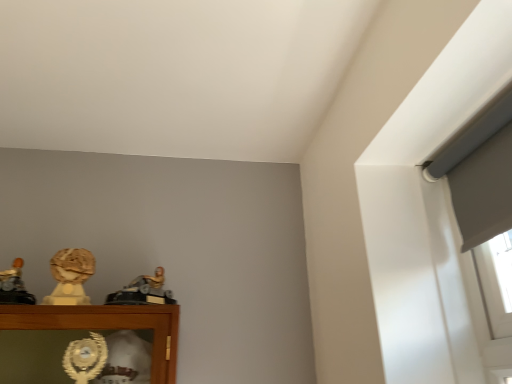
How much space does matte gold bust at left, which appears as the 2th character sculpture when viewed from the left, occupy vertically?

matte gold bust at left, which appears as the 2th character sculpture when viewed from the left, is 6.06 inches in height.

Describe the element at coordinates (14, 286) in the screenshot. This screenshot has height=384, width=512. I see `matte gold statue at left, the 1th character sculpture viewed from the left` at that location.

In order to click on gold metallic figure at center, arranged as the 3th character sculpture when viewed from the left in this screenshot , I will do `click(143, 291)`.

The width and height of the screenshot is (512, 384). I want to click on the 1st character sculpture behind when counting from the matte gold statue at left, the 1th character sculpture viewed from the left, so click(143, 291).

Which of these two, matte gold statue at left, the 1th character sculpture viewed from the left, or gold metallic figure at center, which appears as the first character sculpture when viewed from the right, stands taller?

matte gold statue at left, the 1th character sculpture viewed from the left, is taller.

Is point (12, 282) positioned behind point (136, 304)?

Yes, point (12, 282) is behind point (136, 304).

Is matte gold statue at left, the 3th character sculpture from the right, positioned beyond the bounds of gold metallic figure at center, which appears as the first character sculpture when viewed from the right?

Yes, matte gold statue at left, the 3th character sculpture from the right, is not within gold metallic figure at center, which appears as the first character sculpture when viewed from the right.

Considering the relative positions of gold metallic figure at center, arranged as the 3th character sculpture when viewed from the left, and matte gold bust at left, the second character sculpture positioned from the right, in the image provided, is gold metallic figure at center, arranged as the 3th character sculpture when viewed from the left, to the left of matte gold bust at left, the second character sculpture positioned from the right, from the viewer's perspective?

In fact, gold metallic figure at center, arranged as the 3th character sculpture when viewed from the left, is to the right of matte gold bust at left, the second character sculpture positioned from the right.

Does gold metallic figure at center, which appears as the first character sculpture when viewed from the right, have a greater height compared to matte gold bust at left, which appears as the 2th character sculpture when viewed from the left?

In fact, gold metallic figure at center, which appears as the first character sculpture when viewed from the right, may be shorter than matte gold bust at left, which appears as the 2th character sculpture when viewed from the left.

Consider the image. From a real-world perspective, between gold metallic figure at center, arranged as the 3th character sculpture when viewed from the left, and matte gold bust at left, the second character sculpture positioned from the right, who is vertically lower?

gold metallic figure at center, arranged as the 3th character sculpture when viewed from the left, from a real-world perspective.

Can you confirm if gold metallic figure at center, which appears as the first character sculpture when viewed from the right, is wider than matte gold bust at left, the second character sculpture positioned from the right?

Yes, gold metallic figure at center, which appears as the first character sculpture when viewed from the right, is wider than matte gold bust at left, the second character sculpture positioned from the right.

Considering their positions, is gold metallic figure at center, which appears as the first character sculpture when viewed from the right, located in front of or behind matte gold statue at left, the 3th character sculpture from the right?

gold metallic figure at center, which appears as the first character sculpture when viewed from the right, is behind matte gold statue at left, the 3th character sculpture from the right.

Which of these two, gold metallic figure at center, arranged as the 3th character sculpture when viewed from the left, or matte gold statue at left, the 3th character sculpture from the right, stands taller?

Standing taller between the two is matte gold statue at left, the 3th character sculpture from the right.

Is gold metallic figure at center, arranged as the 3th character sculpture when viewed from the left, far away from matte gold statue at left, the 3th character sculpture from the right?

They are positioned close to each other.

Are matte gold statue at left, the 3th character sculpture from the right, and matte gold bust at left, the second character sculpture positioned from the right, beside each other?

They are not placed beside each other.

In the image, is matte gold statue at left, the 1th character sculpture viewed from the left, positioned in front of or behind matte gold bust at left, which appears as the 2th character sculpture when viewed from the left?

matte gold statue at left, the 1th character sculpture viewed from the left, is positioned closer to the viewer than matte gold bust at left, which appears as the 2th character sculpture when viewed from the left.

From the picture: From the image's perspective, is matte gold statue at left, the 1th character sculpture viewed from the left, on top of matte gold bust at left, the second character sculpture positioned from the right?

No, from the image's perspective, matte gold statue at left, the 1th character sculpture viewed from the left, is not on top of matte gold bust at left, the second character sculpture positioned from the right.

Is matte gold bust at left, the second character sculpture positioned from the right, shorter than gold metallic figure at center, which appears as the first character sculpture when viewed from the right?

No, matte gold bust at left, the second character sculpture positioned from the right, is not shorter than gold metallic figure at center, which appears as the first character sculpture when viewed from the right.

Looking at this image, from the image's perspective, is matte gold bust at left, which appears as the 2th character sculpture when viewed from the left, beneath gold metallic figure at center, arranged as the 3th character sculpture when viewed from the left?

Actually, matte gold bust at left, which appears as the 2th character sculpture when viewed from the left, appears above gold metallic figure at center, arranged as the 3th character sculpture when viewed from the left, in the image.

Is matte gold bust at left, which appears as the 2th character sculpture when viewed from the left, outside of gold metallic figure at center, which appears as the first character sculpture when viewed from the right?

Yes, matte gold bust at left, which appears as the 2th character sculpture when viewed from the left, is located beyond the bounds of gold metallic figure at center, which appears as the first character sculpture when viewed from the right.

Considering the relative sizes of matte gold bust at left, the second character sculpture positioned from the right, and gold metallic figure at center, arranged as the 3th character sculpture when viewed from the left, in the image provided, is matte gold bust at left, the second character sculpture positioned from the right, bigger than gold metallic figure at center, arranged as the 3th character sculpture when viewed from the left,?

No.

In the scene shown: Is matte gold bust at left, which appears as the 2th character sculpture when viewed from the left, facing away from matte gold statue at left, the 3th character sculpture from the right?

matte gold bust at left, which appears as the 2th character sculpture when viewed from the left, does not have its back to matte gold statue at left, the 3th character sculpture from the right.

Is matte gold bust at left, which appears as the 2th character sculpture when viewed from the left, not near matte gold statue at left, the 3th character sculpture from the right?

No, matte gold bust at left, which appears as the 2th character sculpture when viewed from the left, is in close proximity to matte gold statue at left, the 3th character sculpture from the right.

Based on their sizes in the image, would you say matte gold bust at left, which appears as the 2th character sculpture when viewed from the left, is bigger or smaller than matte gold statue at left, the 3th character sculpture from the right?

matte gold bust at left, which appears as the 2th character sculpture when viewed from the left, is smaller than matte gold statue at left, the 3th character sculpture from the right.

Between matte gold bust at left, the second character sculpture positioned from the right, and matte gold statue at left, the 1th character sculpture viewed from the left, which one has larger width?

matte gold statue at left, the 1th character sculpture viewed from the left.

Image resolution: width=512 pixels, height=384 pixels. There is a gold metallic figure at center, which appears as the first character sculpture when viewed from the right. Find the location of `the 1st character sculpture above it (from the image's perspective)`. the 1st character sculpture above it (from the image's perspective) is located at coordinates (14, 286).

At what (x,y) coordinates should I click in order to perform the action: click on character sculpture above the gold metallic figure at center, arranged as the 3th character sculpture when viewed from the left (from a real-world perspective). Please return your answer as a coordinate pair (x, y). This screenshot has width=512, height=384. Looking at the image, I should click on (70, 276).

Looking at the image, which one is located further to matte gold bust at left, which appears as the 2th character sculpture when viewed from the left, matte gold statue at left, the 1th character sculpture viewed from the left, or gold metallic figure at center, arranged as the 3th character sculpture when viewed from the left?

Based on the image, matte gold statue at left, the 1th character sculpture viewed from the left, appears to be further to matte gold bust at left, which appears as the 2th character sculpture when viewed from the left.

When comparing their distances from gold metallic figure at center, which appears as the first character sculpture when viewed from the right, does matte gold statue at left, the 3th character sculpture from the right, or matte gold bust at left, the second character sculpture positioned from the right, seem further?

Based on the image, matte gold statue at left, the 3th character sculpture from the right, appears to be further to gold metallic figure at center, which appears as the first character sculpture when viewed from the right.

Looking at the image, which one is located closer to matte gold statue at left, the 1th character sculpture viewed from the left, matte gold bust at left, the second character sculpture positioned from the right, or gold metallic figure at center, which appears as the first character sculpture when viewed from the right?

Based on the image, matte gold bust at left, the second character sculpture positioned from the right, appears to be nearer to matte gold statue at left, the 1th character sculpture viewed from the left.

When comparing their distances from gold metallic figure at center, which appears as the first character sculpture when viewed from the right, does matte gold bust at left, the second character sculpture positioned from the right, or matte gold statue at left, the 1th character sculpture viewed from the left, seem further?

Based on the image, matte gold statue at left, the 1th character sculpture viewed from the left, appears to be further to gold metallic figure at center, which appears as the first character sculpture when viewed from the right.

When comparing their distances from matte gold bust at left, which appears as the 2th character sculpture when viewed from the left, does gold metallic figure at center, arranged as the 3th character sculpture when viewed from the left, or matte gold statue at left, the 1th character sculpture viewed from the left, seem closer?

The object closer to matte gold bust at left, which appears as the 2th character sculpture when viewed from the left, is gold metallic figure at center, arranged as the 3th character sculpture when viewed from the left.

Considering their positions, is gold metallic figure at center, arranged as the 3th character sculpture when viewed from the left, positioned closer to matte gold statue at left, the 1th character sculpture viewed from the left, than matte gold bust at left, the second character sculpture positioned from the right?

The object closer to matte gold statue at left, the 1th character sculpture viewed from the left, is matte gold bust at left, the second character sculpture positioned from the right.

Find the location of a particular element. character sculpture between matte gold statue at left, the 3th character sculpture from the right, and gold metallic figure at center, which appears as the first character sculpture when viewed from the right, in the horizontal direction is located at coordinates (70, 276).